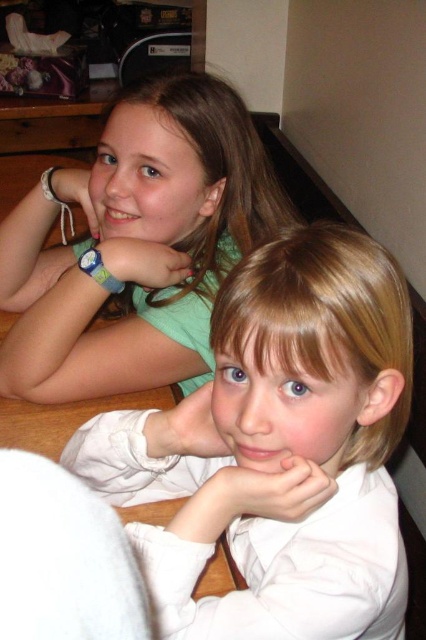
Image resolution: width=426 pixels, height=640 pixels. What do you see at coordinates (278, 451) in the screenshot? I see `white smooth shirt at center` at bounding box center [278, 451].

Consider the image. Does white smooth shirt at center have a greater height compared to green matte shirt at upper left?

No.

This screenshot has width=426, height=640. Describe the element at coordinates (278, 451) in the screenshot. I see `white smooth shirt at center` at that location.

Locate an element on the screen. white smooth shirt at center is located at coordinates [278, 451].